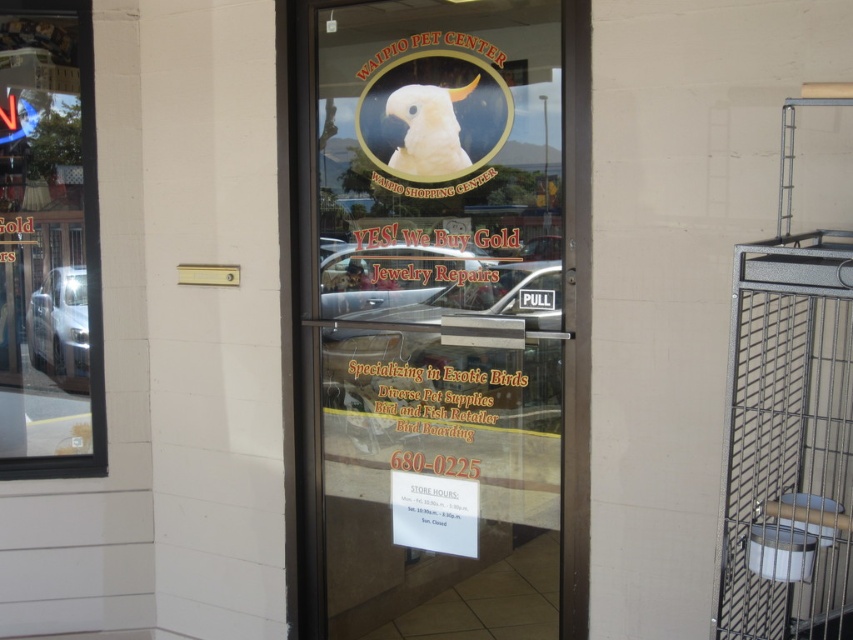
Question: Estimate the real-world distances between objects in this image. Which object is farther from the transparent glass door at center?

Choices:
 (A) transparent glass window at left
 (B) metallic wire cage at right
 (C) white matte parrot at center

Answer: (A)

Question: Considering the real-world distances, which object is farthest from the transparent glass window at left?

Choices:
 (A) white matte parrot at center
 (B) transparent glass door at center
 (C) metallic wire cage at right

Answer: (C)

Question: Which of the following is the farthest from the observer?

Choices:
 (A) (57, 403)
 (B) (576, 29)
 (C) (416, 116)
 (D) (821, 525)

Answer: (A)

Question: Can you confirm if transparent glass door at center is smaller than white matte parrot at center?

Choices:
 (A) yes
 (B) no

Answer: (B)

Question: Is metallic wire cage at right to the right of transparent glass window at left from the viewer's perspective?

Choices:
 (A) yes
 (B) no

Answer: (A)

Question: Can you confirm if metallic wire cage at right is thinner than transparent glass window at left?

Choices:
 (A) no
 (B) yes

Answer: (A)